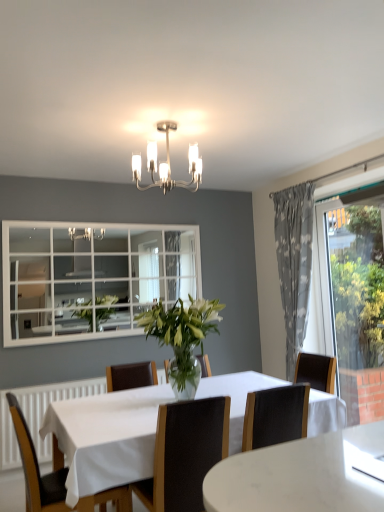
The height and width of the screenshot is (512, 384). Describe the element at coordinates (294, 263) in the screenshot. I see `gray fabric curtain at right` at that location.

The width and height of the screenshot is (384, 512). What do you see at coordinates (37, 469) in the screenshot?
I see `wooden chair at lower left, which appears as the second chair when viewed from the right` at bounding box center [37, 469].

Measure the distance between white marble table at center and camera.

The distance of white marble table at center from camera is 1.88 meters.

Where is `gray fabric curtain at right`? Image resolution: width=384 pixels, height=512 pixels. gray fabric curtain at right is located at coordinates (294, 263).

Who is more distant, white marble table at center or metallic chandelier at upper center?

Positioned behind is metallic chandelier at upper center.

From the image's perspective, is white marble table at center located above metallic chandelier at upper center?

Actually, white marble table at center appears below metallic chandelier at upper center in the image.

Between white marble table at center and metallic chandelier at upper center, which one appears on the left side from the viewer's perspective?

From the viewer's perspective, metallic chandelier at upper center appears more on the left side.

Between white marble table at center and metallic chandelier at upper center, which one has larger width?

white marble table at center.

From the image's perspective, which is above, gray fabric curtain at right or transparent glass window at right?

gray fabric curtain at right is shown above in the image.

At what (x,y) coordinates should I click in order to perform the action: click on window screen below the gray fabric curtain at right (from a real-world perspective). Please return your answer as a coordinate pair (x, y). This screenshot has height=512, width=384. Looking at the image, I should click on (354, 297).

From a real-world perspective, is gray fabric curtain at right positioned above or below transparent glass window at right?

Clearly, from a real-world perspective, gray fabric curtain at right is above transparent glass window at right.

What's the angular difference between gray fabric curtain at right and transparent glass window at right's facing directions?

0.000783 degrees separate the facing orientations of gray fabric curtain at right and transparent glass window at right.

Is point (53, 410) positioned behind point (42, 484)?

That is True.

Which is in front, white marble table at center or wooden chair at lower left, which appears as the second chair when viewed from the right?

white marble table at center is closer to the camera.

Measure the distance from white marble table at center to wooden chair at lower left, which appears as the second chair when viewed from the right.

white marble table at center and wooden chair at lower left, which appears as the second chair when viewed from the right, are 14.09 inches apart.

Consider the image. Which of these two, white marble table at center or wooden chair at lower left, marked as the 1th chair in a left-to-right arrangement, is wider?

With larger width is white marble table at center.

From the image's perspective, which is above, black leather chair at center, which ranks as the 1th chair in right-to-left order, or white marble table at center?

From the image's view, black leather chair at center, which ranks as the 1th chair in right-to-left order, is above.

Which is in front, black leather chair at center, which ranks as the 1th chair in right-to-left order, or white marble table at center?

white marble table at center.

Image resolution: width=384 pixels, height=512 pixels. Identify the location of the 1st chair counting from the left of the white marble table at center. (185, 453).

Is black leather chair at center, which ranks as the second chair in left-to-right order, turned away from white marble table at center?

That's right, black leather chair at center, which ranks as the second chair in left-to-right order, is facing away from white marble table at center.

From a real-world perspective, which is physically below, wooden chair at lower left, which appears as the second chair when viewed from the right, or white marble table at center?

white marble table at center.

Which of these two, wooden chair at lower left, marked as the 1th chair in a left-to-right arrangement, or white marble table at center, is bigger?

Bigger between the two is white marble table at center.

Considering the sizes of objects wooden chair at lower left, marked as the 1th chair in a left-to-right arrangement, and white marble table at center in the image provided, who is thinner, wooden chair at lower left, marked as the 1th chair in a left-to-right arrangement, or white marble table at center?

wooden chair at lower left, marked as the 1th chair in a left-to-right arrangement.

Which chair is the 2nd one when counting from the left side of the white marble table at center? Please provide its 2D coordinates.

[(37, 469)]

I want to click on kitchen & dining room table beneath the gray fabric curtain at right (from a real-world perspective), so click(106, 437).

Is gray fabric curtain at right further to camera compared to white marble table at center?

Yes.

Does point (296, 256) come closer to viewer compared to point (117, 401)?

No, it is behind (117, 401).

Which object is wider, black leather chair at center, which ranks as the second chair in left-to-right order, or transparent glass window at right?

Wider between the two is black leather chair at center, which ranks as the second chair in left-to-right order.

Is black leather chair at center, which ranks as the second chair in left-to-right order, placed right next to transparent glass window at right?

They are not placed beside each other.

From the picture: Is black leather chair at center, which ranks as the 1th chair in right-to-left order, aimed at transparent glass window at right?

No, black leather chair at center, which ranks as the 1th chair in right-to-left order, is not oriented towards transparent glass window at right.

Is point (155, 459) closer to viewer compared to point (326, 261)?

Yes, it is.

What are the coordinates of `lamp behind the white marble table at center` in the screenshot? It's located at (167, 164).

Locate an element on the screen. This screenshot has width=384, height=512. curtain above the transparent glass window at right (from the image's perspective) is located at coordinates (294, 263).

Estimate the real-world distances between objects in this image. Which object is further from wooden chair at lower left, marked as the 1th chair in a left-to-right arrangement, transparent glass window at right or metallic chandelier at upper center?

The object further to wooden chair at lower left, marked as the 1th chair in a left-to-right arrangement, is transparent glass window at right.

Which object lies further to the anchor point gray fabric curtain at right, white marble table at center or wooden chair at lower left, marked as the 1th chair in a left-to-right arrangement?

wooden chair at lower left, marked as the 1th chair in a left-to-right arrangement, lies further to gray fabric curtain at right than the other object.

Based on their spatial positions, is transparent glass window at right or wooden chair at lower left, which appears as the second chair when viewed from the right, closer to gray fabric curtain at right?

Based on the image, transparent glass window at right appears to be nearer to gray fabric curtain at right.

From the image, which object appears to be farther from gray fabric curtain at right, white marble table at center or metallic chandelier at upper center?

The object further to gray fabric curtain at right is white marble table at center.

From the image, which object appears to be farther from transparent glass window at right, wooden chair at lower left, which appears as the second chair when viewed from the right, or white marble table at center?

The object further to transparent glass window at right is wooden chair at lower left, which appears as the second chair when viewed from the right.

Looking at the image, which one is located further to wooden chair at lower left, marked as the 1th chair in a left-to-right arrangement, black leather chair at center, which ranks as the 1th chair in right-to-left order, or transparent glass window at right?

transparent glass window at right is further to wooden chair at lower left, marked as the 1th chair in a left-to-right arrangement.

Considering their positions, is wooden chair at lower left, marked as the 1th chair in a left-to-right arrangement, positioned closer to black leather chair at center, which ranks as the second chair in left-to-right order, than transparent glass window at right?

wooden chair at lower left, marked as the 1th chair in a left-to-right arrangement, is closer to black leather chair at center, which ranks as the second chair in left-to-right order.

Considering their positions, is wooden chair at lower left, marked as the 1th chair in a left-to-right arrangement, positioned further to gray fabric curtain at right than white marble table at center?

wooden chair at lower left, marked as the 1th chair in a left-to-right arrangement.

At what (x,y) coordinates should I click in order to perform the action: click on curtain between metallic chandelier at upper center and wooden chair at lower left, which appears as the second chair when viewed from the right, in the vertical direction. Please return your answer as a coordinate pair (x, y). Image resolution: width=384 pixels, height=512 pixels. Looking at the image, I should click on (294, 263).

This screenshot has width=384, height=512. What are the coordinates of `curtain between wooden chair at lower left, marked as the 1th chair in a left-to-right arrangement, and transparent glass window at right, in the horizontal direction` in the screenshot? It's located at (294, 263).

Where is `kitchen & dining room table between black leather chair at center, which ranks as the 1th chair in right-to-left order, and transparent glass window at right from left to right`? kitchen & dining room table between black leather chair at center, which ranks as the 1th chair in right-to-left order, and transparent glass window at right from left to right is located at coordinates [106, 437].

Identify the location of window screen between white marble table at center and gray fabric curtain at right from front to back. This screenshot has width=384, height=512. (354, 297).